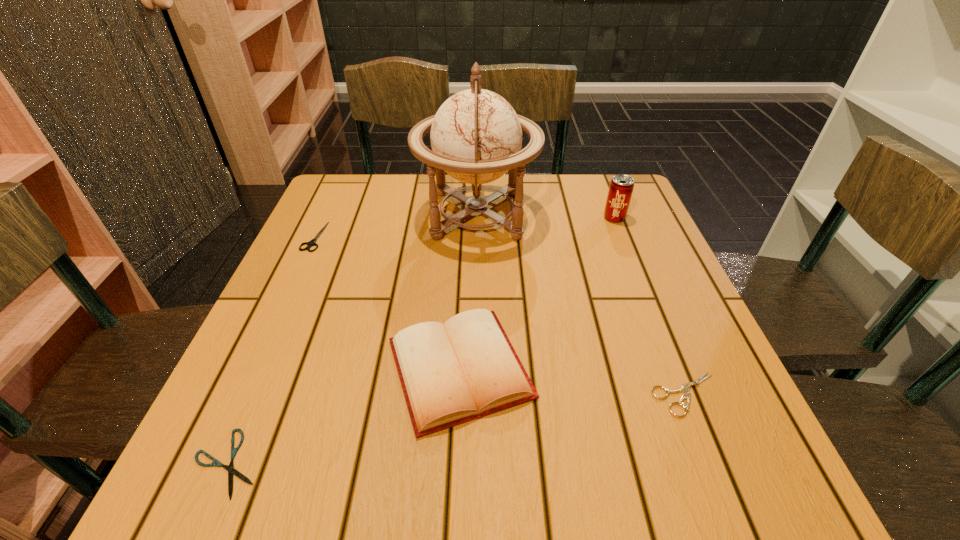
Image resolution: width=960 pixels, height=540 pixels. Find the location of `shears present at the right edge`. shears present at the right edge is located at coordinates (685, 388).

Identify the location of object present at the far left corner. (312, 242).

Where is `object located at the near left corner`? Image resolution: width=960 pixels, height=540 pixels. object located at the near left corner is located at coordinates (230, 468).

The image size is (960, 540). What are the coordinates of `object situated at the far right corner` in the screenshot? It's located at (621, 187).

Locate an element on the screen. The height and width of the screenshot is (540, 960). free space at the far edge of the desktop is located at coordinates (409, 213).

Identify the location of vacant space at the near edge of the desktop. The image size is (960, 540). (391, 465).

Find the location of `vacant space at the left edge`. vacant space at the left edge is located at coordinates (272, 342).

Where is `free space at the right edge of the desktop`? Image resolution: width=960 pixels, height=540 pixels. free space at the right edge of the desktop is located at coordinates (607, 252).

The width and height of the screenshot is (960, 540). In order to click on free spot at the far left corner of the desktop in this screenshot , I will do `click(328, 193)`.

At what (x,y) coordinates should I click in order to perform the action: click on free space between the Bible and the beer can. Please return your answer as a coordinate pair (x, y). The width and height of the screenshot is (960, 540). Looking at the image, I should click on (537, 293).